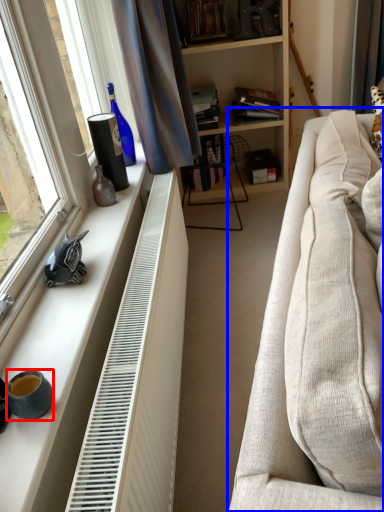
Question: Which object appears farthest to the camera in this image, coffee cup (highlighted by a red box) or studio couch (highlighted by a blue box)?

Choices:
 (A) coffee cup
 (B) studio couch

Answer: (A)